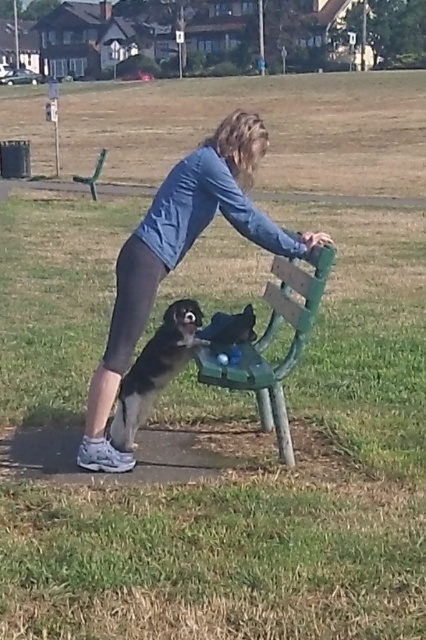
Question: Does blue denim jacket at upper center appear over green wooden bench at center?

Choices:
 (A) no
 (B) yes

Answer: (B)

Question: Is blue denim jacket at upper center further to camera compared to green wooden bench at center?

Choices:
 (A) yes
 (B) no

Answer: (A)

Question: Does blue denim jacket at upper center appear under green wooden bench at center?

Choices:
 (A) yes
 (B) no

Answer: (B)

Question: Which object is farther from the camera taking this photo?

Choices:
 (A) blue denim jacket at upper center
 (B) green wooden bench at center

Answer: (A)